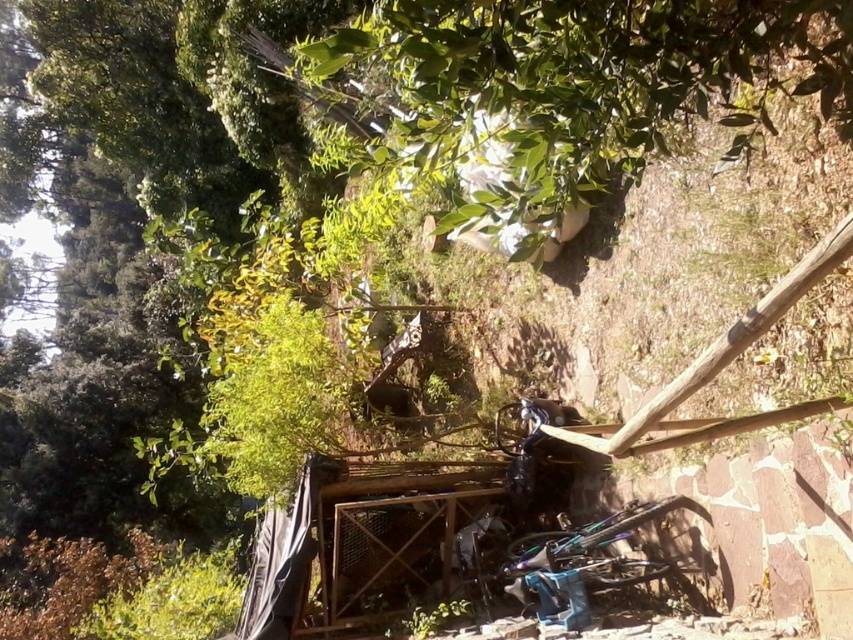
Question: Is the position of green leafy tree at upper center less distant than that of shiny metallic bicycle at center?

Choices:
 (A) no
 (B) yes

Answer: (B)

Question: Can you confirm if green leafy tree at upper center is positioned below shiny metallic bicycle at center?

Choices:
 (A) no
 (B) yes

Answer: (A)

Question: Which point appears farthest from the camera in this image?

Choices:
 (A) (618, 58)
 (B) (614, 540)

Answer: (B)

Question: Which object appears farthest from the camera in this image?

Choices:
 (A) green leafy tree at upper center
 (B) shiny metallic bicycle at center

Answer: (B)

Question: Does green leafy tree at upper center lie in front of shiny metallic bicycle at center?

Choices:
 (A) yes
 (B) no

Answer: (A)